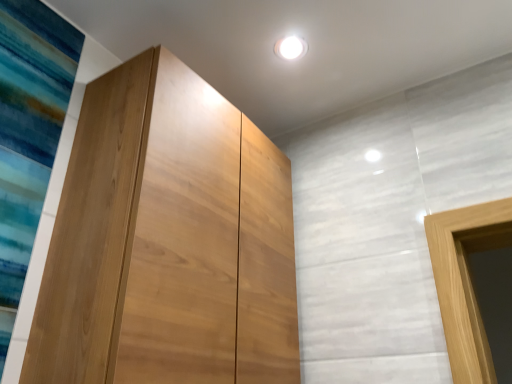
This screenshot has width=512, height=384. Describe the element at coordinates (168, 241) in the screenshot. I see `natural wood cupboard at left` at that location.

The height and width of the screenshot is (384, 512). In order to click on natural wood cupboard at left in this screenshot , I will do `click(168, 241)`.

Locate an element on the screen. Image resolution: width=512 pixels, height=384 pixels. natural wood cupboard at left is located at coordinates (168, 241).